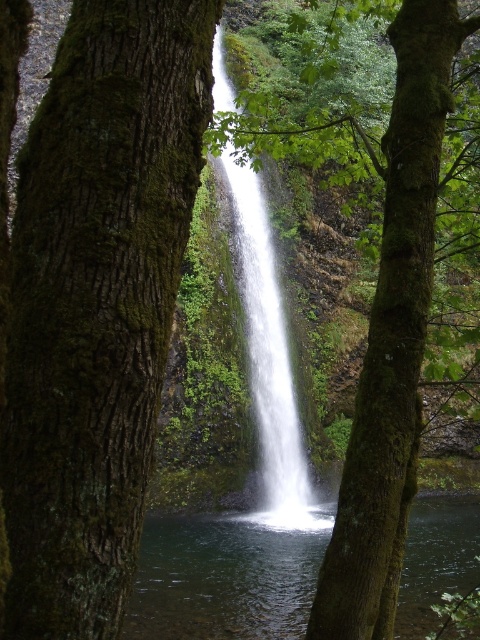
Which is in front, point (51, 196) or point (252, 269)?

Point (51, 196)

At what (x,y) coordinates should I click in order to perform the action: click on green mossy bark tree at center. Please return your answer as a coordinate pair (x, y). Looking at the image, I should click on (96, 301).

Is point (28, 285) more distant than point (317, 524)?

No, (28, 285) is in front of (317, 524).

What do you see at coordinates (96, 301) in the screenshot? I see `green mossy bark tree at center` at bounding box center [96, 301].

Locate an element on the screen. green mossy bark tree at center is located at coordinates (96, 301).

Locate an element on the screen. The width and height of the screenshot is (480, 640). green mossy bark tree at center is located at coordinates (96, 301).

Does white glossy waterfall at center have a lesser width compared to green mossy tree at center?

In fact, white glossy waterfall at center might be wider than green mossy tree at center.

Does white glossy waterfall at center have a greater height compared to green mossy tree at center?

Incorrect, white glossy waterfall at center's height is not larger of green mossy tree at center's.

You are a GUI agent. You are given a task and a screenshot of the screen. Output one action in this format:
    pyautogui.click(x=<x>, y=<y>)
    Task: Click on the white glossy waterfall at center
    
    Given the screenshot: What is the action you would take?
    pyautogui.click(x=268, y=356)